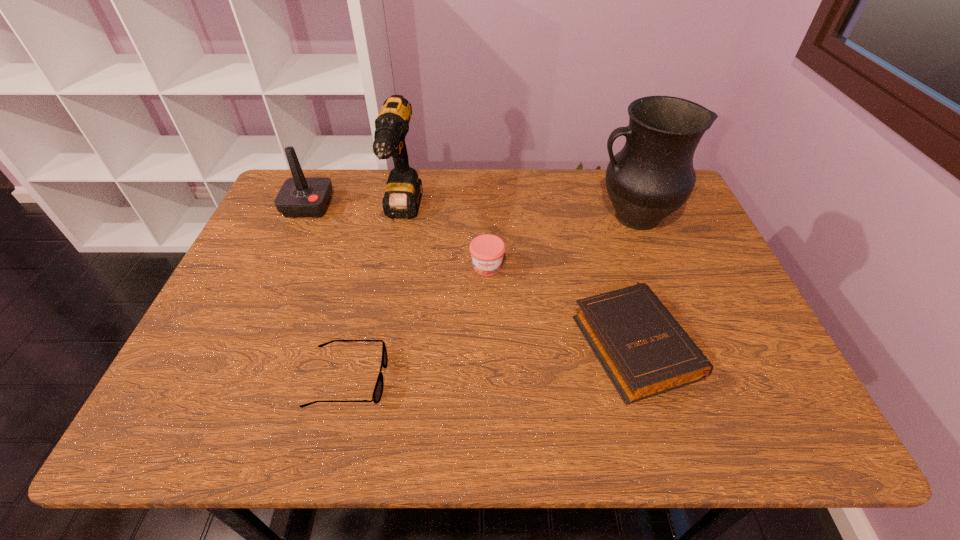
Find the location of `vacant point located between the jam and the pitcher`. vacant point located between the jam and the pitcher is located at coordinates (561, 241).

Choose which object is the fifth nearest neighbor to the joystick. Please provide its 2D coordinates. Your answer should be formatted as a tuple, i.e. [(x, y)], where the tuple contains the x and y coordinates of a point satisfying the conditions above.

[(652, 176)]

This screenshot has width=960, height=540. Identify the location of the fifth closest object to the shortest object. (652, 176).

At what (x,y) coordinates should I click in order to perform the action: click on free region that satisfies the following two spatial constraints: 1. on the handle side of the pitcher; 2. on the front label of the third nearest object. Please return your answer as a coordinate pair (x, y). The width and height of the screenshot is (960, 540). Looking at the image, I should click on (653, 266).

I want to click on free region that satisfies the following two spatial constraints: 1. on the handle side of the pitcher; 2. on the front label of the jam, so click(x=653, y=266).

I want to click on blank space that satisfies the following two spatial constraints: 1. on the front label of the fourth object from left to right; 2. on the front-facing side of the spectacles, so click(489, 379).